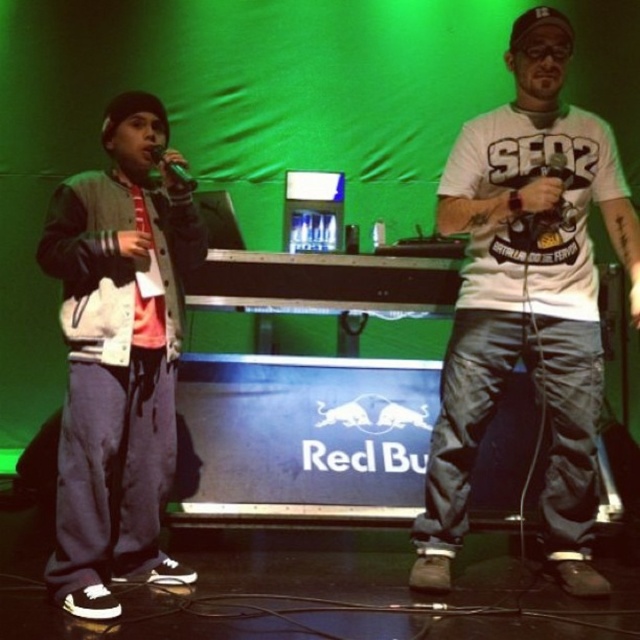
Question: Is the position of white matte t-shirt at center less distant than that of matte gray jacket at left?

Choices:
 (A) yes
 (B) no

Answer: (B)

Question: Which point is closer to the camera?

Choices:
 (A) white matte t-shirt at center
 (B) matte gray jacket at left

Answer: (B)

Question: Does white matte t-shirt at center come in front of matte gray jacket at left?

Choices:
 (A) yes
 (B) no

Answer: (B)

Question: Can you confirm if white matte t-shirt at center is positioned to the left of matte gray jacket at left?

Choices:
 (A) yes
 (B) no

Answer: (B)

Question: Which point is farther to the camera?

Choices:
 (A) (118, 433)
 (B) (576, 176)

Answer: (B)